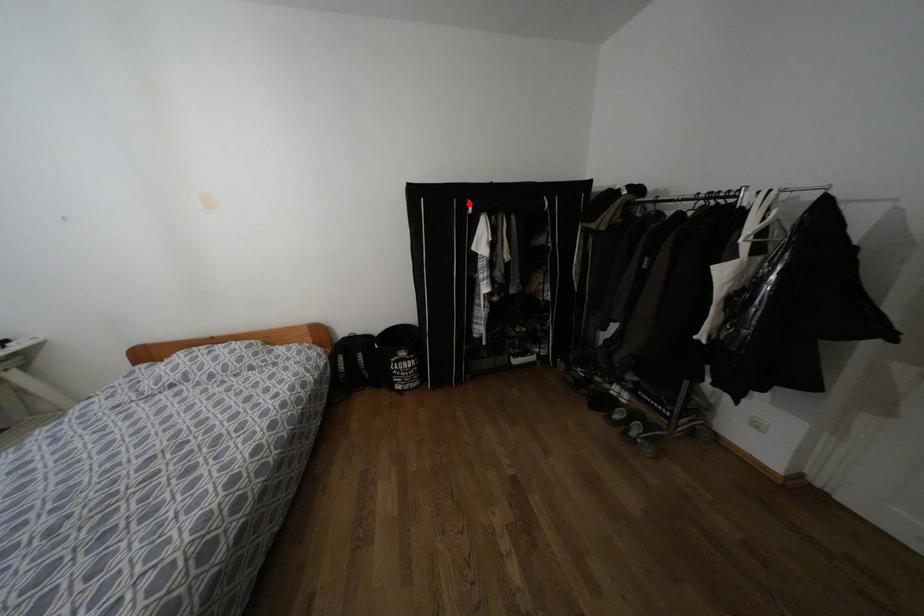
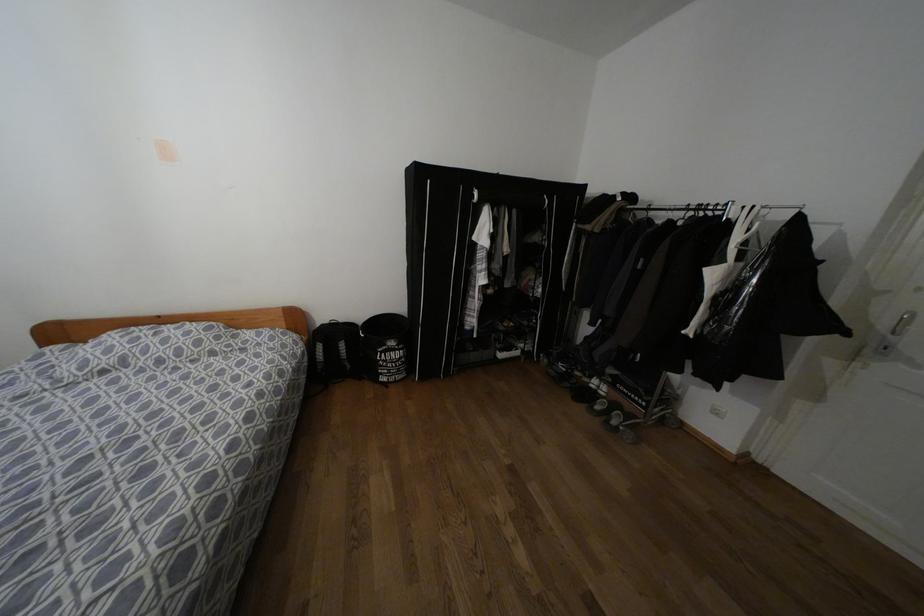
Find the pixel in the second image that matches the highlighted location in the first image.

(475, 192)